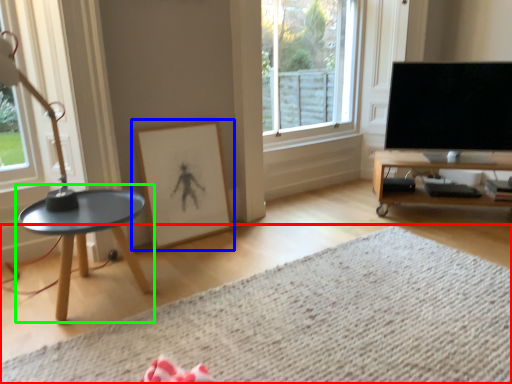
Question: Which object is positioned closest to plain (highlighted by a red box)? Select from picture frame (highlighted by a blue box) and coffee table (highlighted by a green box).

Choices:
 (A) picture frame
 (B) coffee table

Answer: (B)